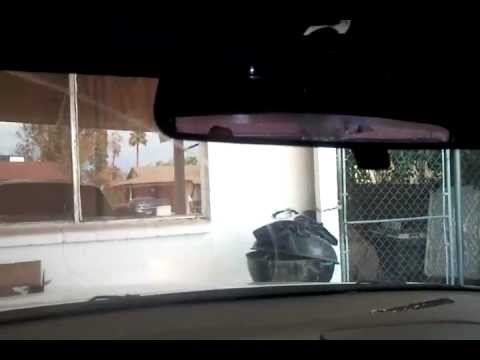
The image size is (480, 360). In order to click on mirror in this screenshot , I will do `click(304, 123)`.